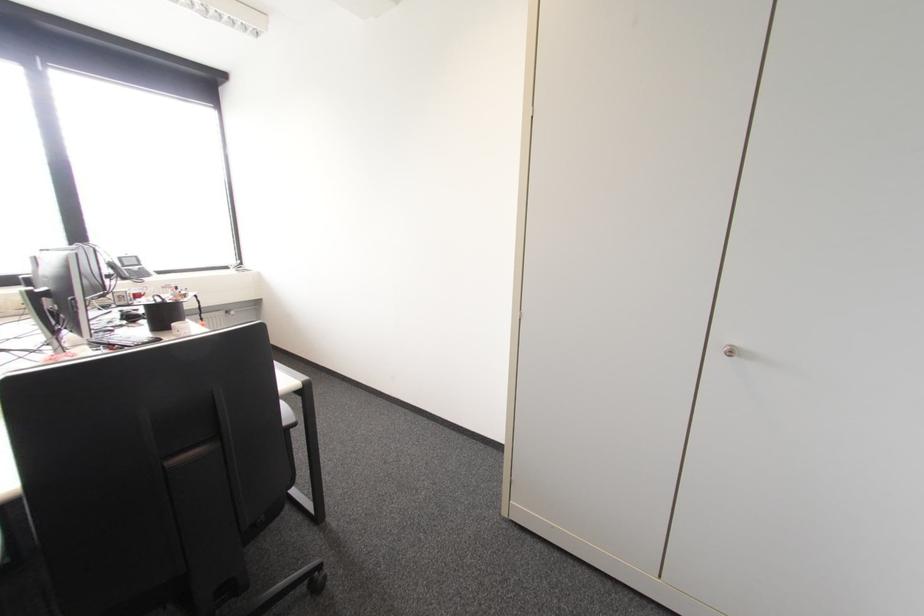
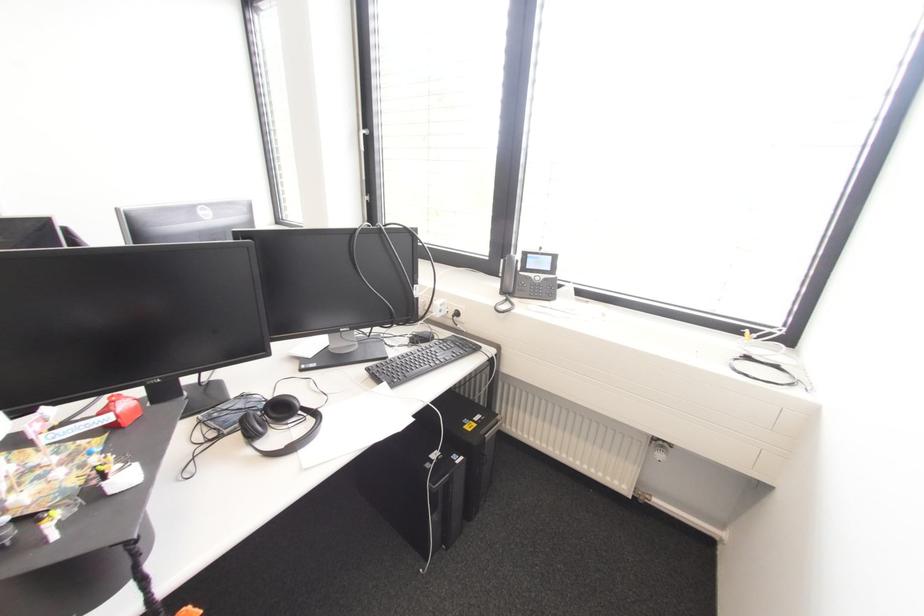
In the second image, find the point that corresponds to pixel 123 278 in the first image.

(503, 292)